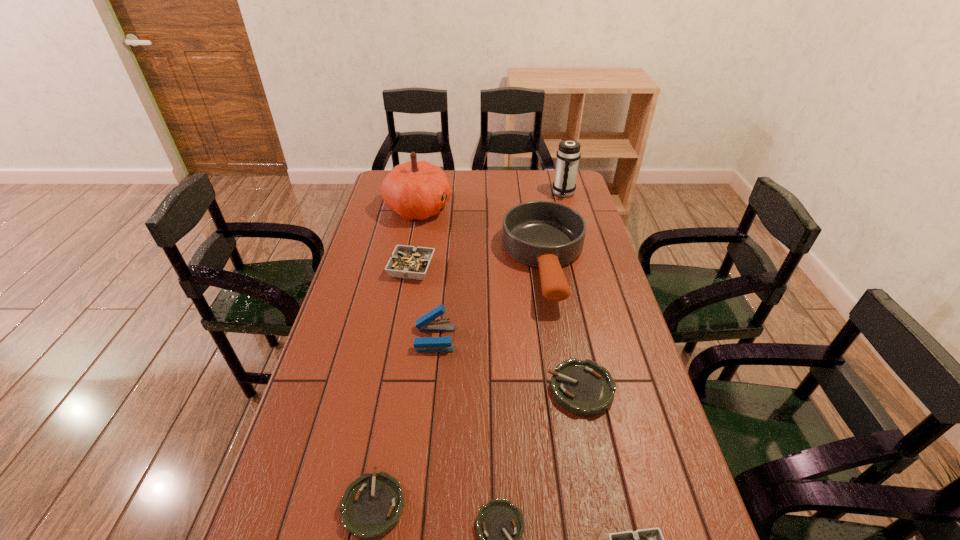
This screenshot has width=960, height=540. Identify the location of thermos bottle situated at the right edge. (568, 154).

Where is `pan at the right edge`? pan at the right edge is located at coordinates (547, 235).

Where is `ashtray that is at the right edge`? This screenshot has height=540, width=960. ashtray that is at the right edge is located at coordinates (583, 387).

This screenshot has width=960, height=540. I want to click on object that is at the far left corner, so click(x=414, y=190).

Find the location of a particular element. This screenshot has width=960, height=540. object positioned at the far right corner is located at coordinates (568, 154).

Identify the location of vacant point at the far edge. (482, 174).

In the image, there is a desktop. Identify the location of vacant region at the left edge. (353, 446).

Find the location of a particular element. The image size is (960, 540). free space at the right edge of the desktop is located at coordinates (580, 305).

The height and width of the screenshot is (540, 960). What are the coordinates of `vacant space at the far right corner of the desktop` in the screenshot? It's located at (577, 193).

Image resolution: width=960 pixels, height=540 pixels. I want to click on vacant space that is in between the fourth tallest object and the farthest green ashtray, so click(508, 364).